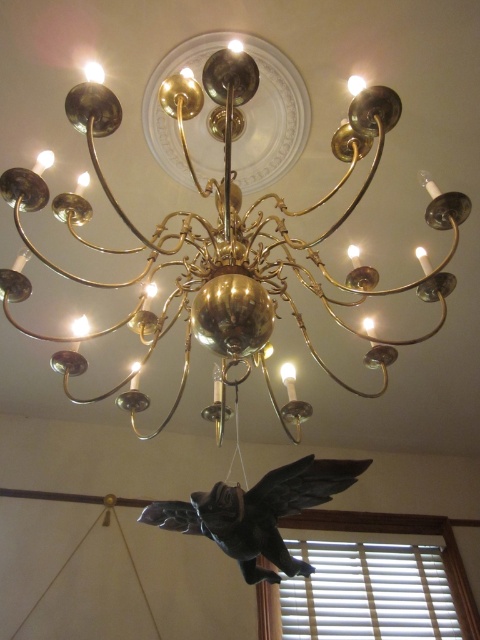
Question: From the image, what is the correct spatial relationship of gold polished chandelier at center in relation to black matte bird at center?

Choices:
 (A) above
 (B) below

Answer: (A)

Question: Does gold polished chandelier at center appear under black matte bird at center?

Choices:
 (A) no
 (B) yes

Answer: (A)

Question: Among these objects, which one is nearest to the camera?

Choices:
 (A) gold polished chandelier at center
 (B) black matte bird at center

Answer: (A)

Question: Does gold polished chandelier at center have a greater width compared to black matte bird at center?

Choices:
 (A) no
 (B) yes

Answer: (B)